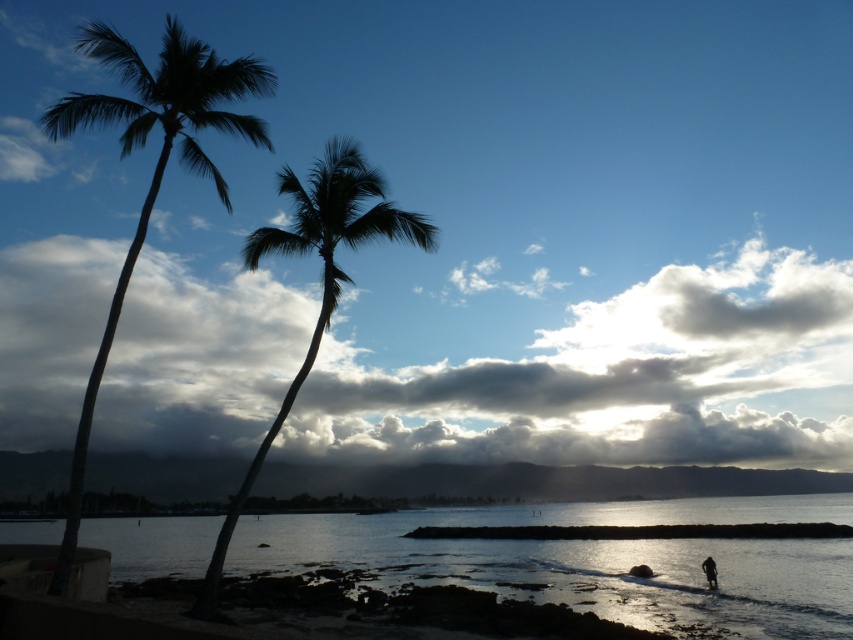
Who is more forward, (335, 156) or (706, 557)?

Point (335, 156) is in front.

Is silhouette leafy palm at center shorter than dark skin textured person at lower right?

In fact, silhouette leafy palm at center may be taller than dark skin textured person at lower right.

This screenshot has width=853, height=640. What do you see at coordinates (322, 278) in the screenshot?
I see `silhouette leafy palm at center` at bounding box center [322, 278].

Where is `silhouette leafy palm at center`? silhouette leafy palm at center is located at coordinates (x=322, y=278).

Can you confirm if cloudy sky at upper center is positioned to the left of silhouette leafy palm at center?

In fact, cloudy sky at upper center is to the right of silhouette leafy palm at center.

Does point (183, 396) lie behind point (302, 252)?

Yes, point (183, 396) is behind point (302, 252).

At what (x,y) coordinates should I click in order to perform the action: click on cloudy sky at upper center. Please return your answer as a coordinate pair (x, y). This screenshot has height=640, width=853. Looking at the image, I should click on (619, 378).

Which is above, cloudy sky at upper center or glistening water at lower center?

cloudy sky at upper center

Looking at this image, can you confirm if cloudy sky at upper center is bigger than glistening water at lower center?

Yes, cloudy sky at upper center is bigger than glistening water at lower center.

Is point (85, 380) farther from camera compared to point (166, 557)?

Yes, it is behind point (166, 557).

Identify the location of cloudy sky at upper center. click(x=619, y=378).